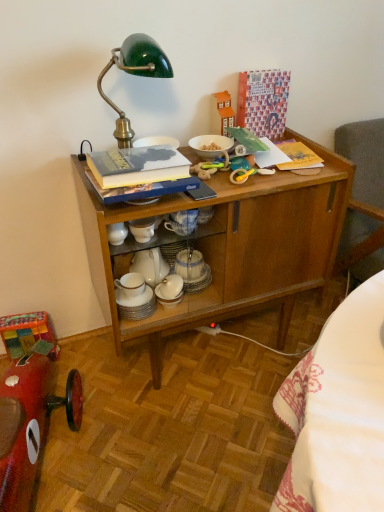
The width and height of the screenshot is (384, 512). Identify the location of free space in front of white glossy bowl at upper center, arranged as the 1th tableware when viewed from the right. (225, 182).